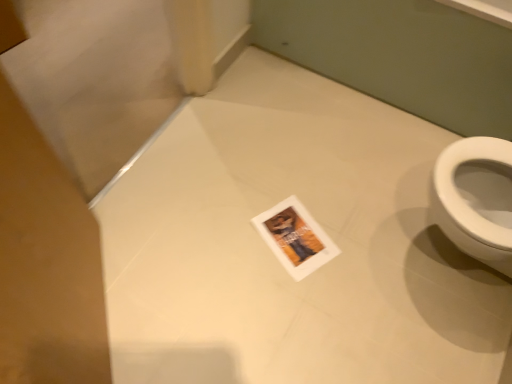
Question: Should I look upward or downward to see white paper postcard at center?

Choices:
 (A) down
 (B) up

Answer: (A)